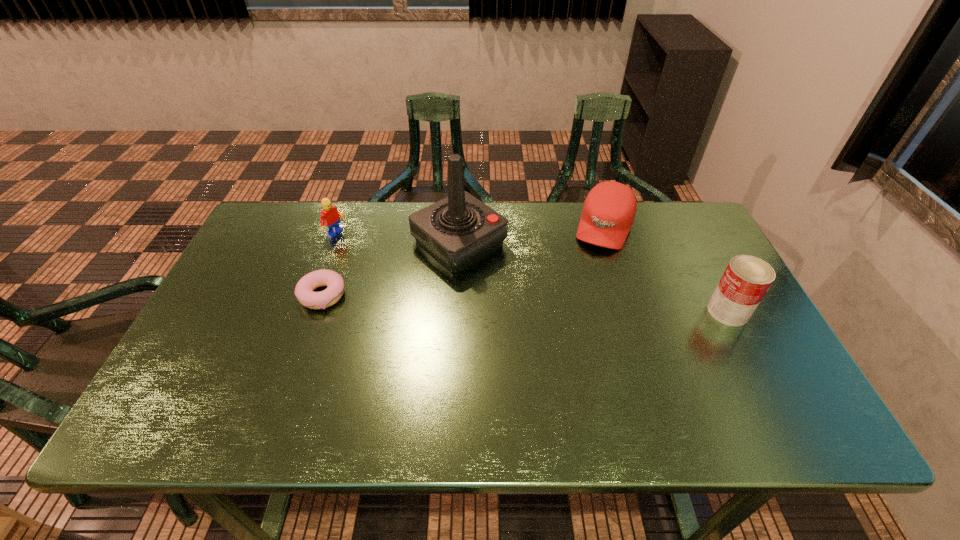
I want to click on vacant region located 0.190m on the front-facing side of the cap, so tap(583, 294).

The height and width of the screenshot is (540, 960). Identify the location of vacant area situated 0.160m on the front-facing side of the joystick. (531, 299).

In order to click on vacant space located 0.110m on the front-facing side of the joystick in this screenshot , I will do `click(517, 289)`.

Locate an element on the screen. The image size is (960, 540). free space located 0.070m on the front-facing side of the joystick is located at coordinates (508, 281).

Find the location of a particular element. vacant point located on the front-facing side of the Lego is located at coordinates (420, 279).

The image size is (960, 540). I want to click on blank space located 0.390m on the front-facing side of the Lego, so (445, 293).

The width and height of the screenshot is (960, 540). Find the location of `free location located on the front-facing side of the Lego`. free location located on the front-facing side of the Lego is located at coordinates (380, 259).

What are the coordinates of `cap located at the far edge` in the screenshot? It's located at (608, 213).

Identify the location of joystick that is at the far edge. (458, 230).

The height and width of the screenshot is (540, 960). Find the location of `Lego at the far edge`. Lego at the far edge is located at coordinates (330, 217).